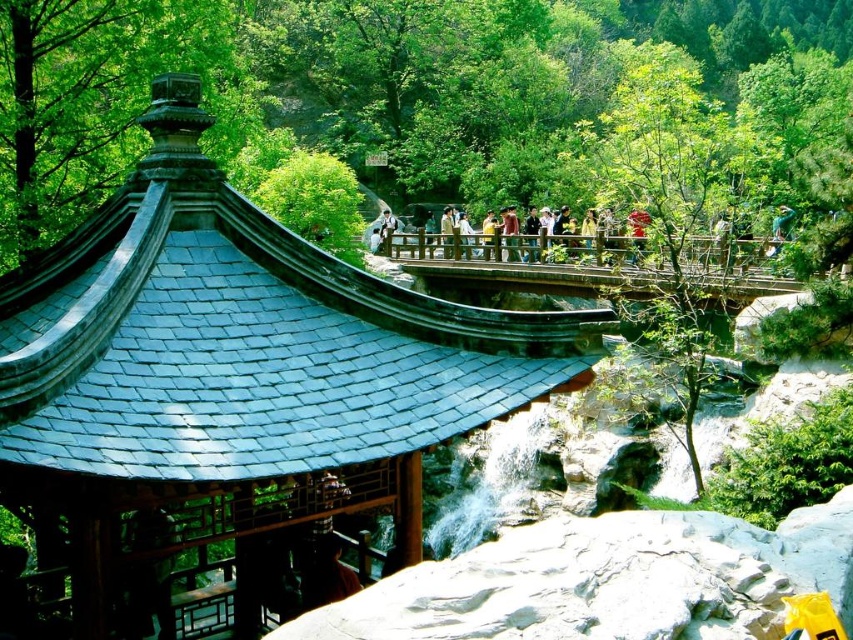
Question: Considering the real-world distances, which object is farthest from the red fabric person at center?

Choices:
 (A) brown wooden bridge at center
 (B) shiny dark blue roof at center

Answer: (B)

Question: From the image, what is the correct spatial relationship of shiny dark blue roof at center in relation to red fabric person at center?

Choices:
 (A) below
 (B) above

Answer: (A)

Question: Where is shiny dark blue roof at center located in relation to red fabric person at center in the image?

Choices:
 (A) below
 (B) above

Answer: (A)

Question: Does brown wooden bridge at center have a smaller size compared to red fabric person at center?

Choices:
 (A) no
 (B) yes

Answer: (A)

Question: Which of the following is the closest to the observer?

Choices:
 (A) (645, 212)
 (B) (402, 266)

Answer: (A)

Question: Which object is closer to the camera taking this photo?

Choices:
 (A) red fabric person at center
 (B) shiny dark blue roof at center

Answer: (B)